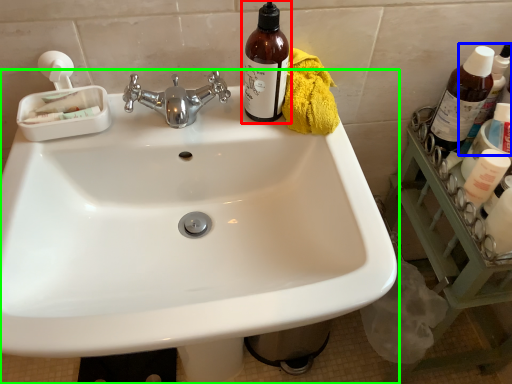
Question: Estimate the real-world distances between objects in this image. Which object is farther from bottle (highlighted by a red box), bottle (highlighted by a blue box) or sink (highlighted by a green box)?

Choices:
 (A) bottle
 (B) sink

Answer: (A)